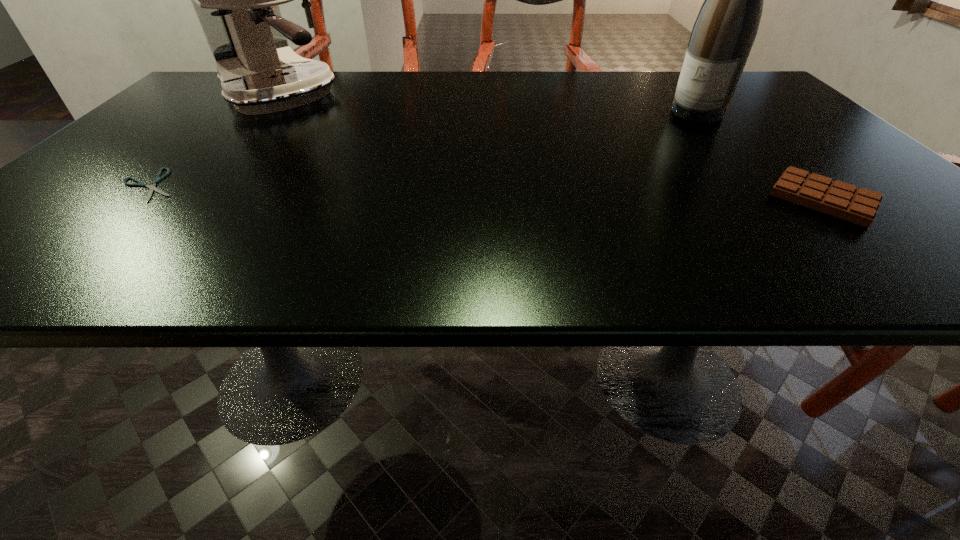
The width and height of the screenshot is (960, 540). Find the location of `object present at the far right corner`. object present at the far right corner is located at coordinates (722, 37).

The height and width of the screenshot is (540, 960). Identify the location of object present at the near right corner. (836, 198).

Where is `vacant space at the far edge of the desktop`? This screenshot has width=960, height=540. vacant space at the far edge of the desktop is located at coordinates (495, 83).

You are a GUI agent. You are given a task and a screenshot of the screen. Output one action in this format:
    pyautogui.click(x=<x>, y=<y>)
    Task: Click on the free space at the near edge of the desktop
    This screenshot has height=540, width=960.
    Given the screenshot: What is the action you would take?
    pyautogui.click(x=172, y=229)

This screenshot has width=960, height=540. In the image, there is a desktop. What are the coordinates of `vacant space at the right edge` in the screenshot? It's located at (756, 107).

Image resolution: width=960 pixels, height=540 pixels. What are the coordinates of `vacant space at the far right corner` in the screenshot? It's located at (754, 95).

The image size is (960, 540). I want to click on free spot between the wine bottle and the coffee maker, so click(489, 105).

Find the location of a particular element. empty space that is in between the wine bottle and the candy bar is located at coordinates (760, 156).

Identify the location of vacant space that is in between the wine bottle and the coffee maker. The width and height of the screenshot is (960, 540). (489, 105).

Locate an element on the screen. This screenshot has height=540, width=960. free area in between the candy bar and the shortest object is located at coordinates (487, 192).